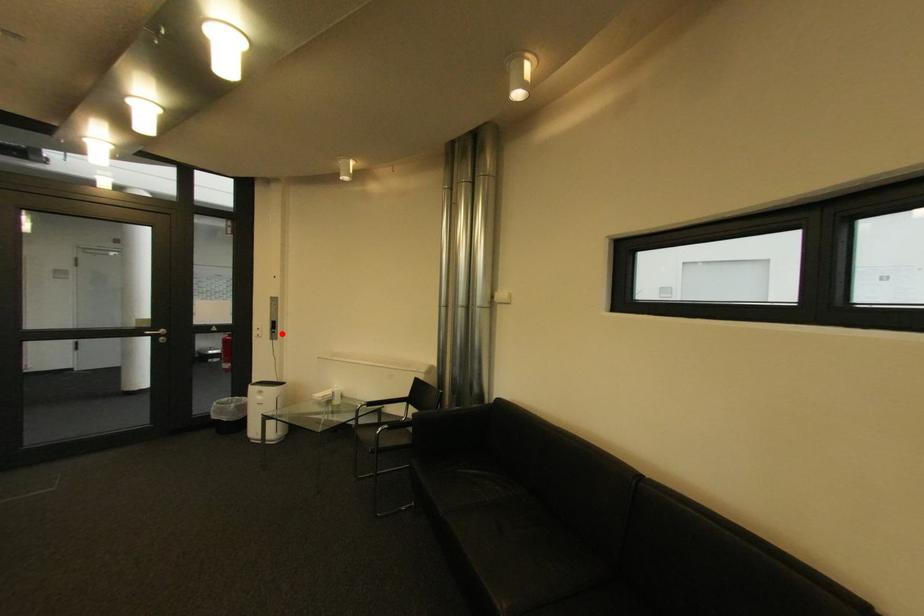
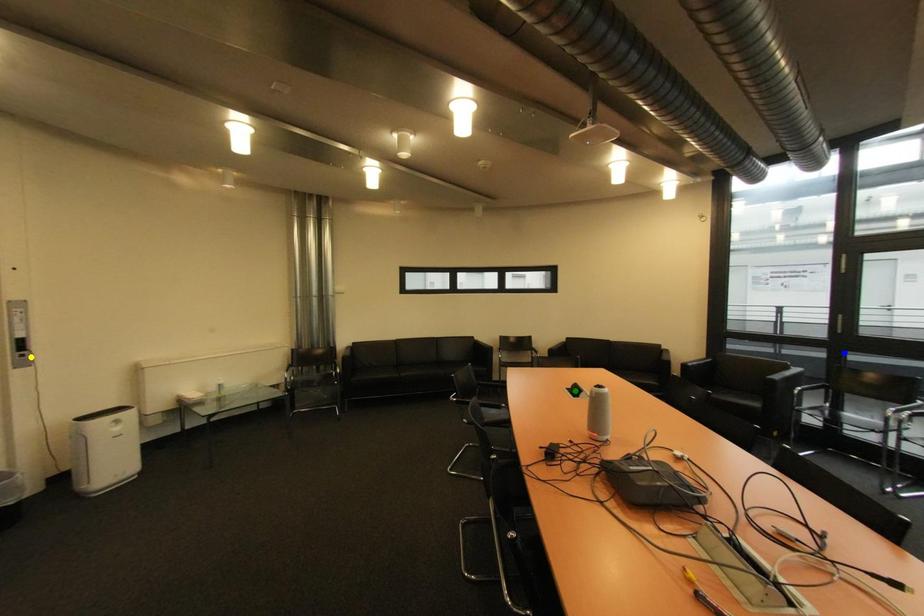
Question: I am providing you with two images of the same scene from different viewpoints. A red point is marked on the first image. You are given multiple points on the second image. Which spot in image 2 lines up with the point in image 1?

Choices:
 (A) yellow point
 (B) green point
 (C) blue point

Answer: (A)